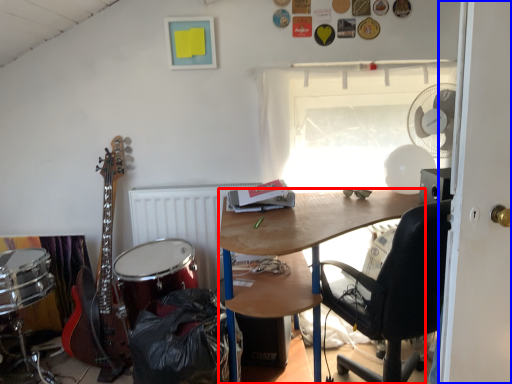
Question: Which object appears farthest to the camera in this image, desk (highlighted by a red box) or door (highlighted by a blue box)?

Choices:
 (A) desk
 (B) door

Answer: (A)